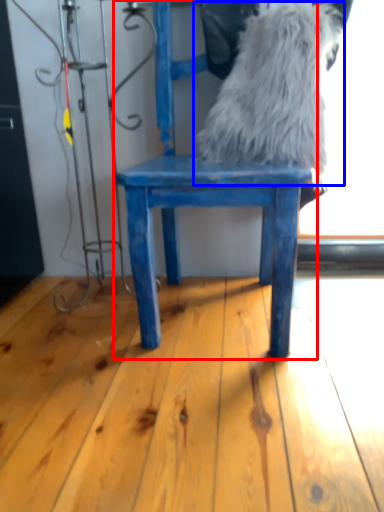
Question: Which object is closer to the camera taking this photo, chair (highlighted by a red box) or animal (highlighted by a blue box)?

Choices:
 (A) chair
 (B) animal

Answer: (A)